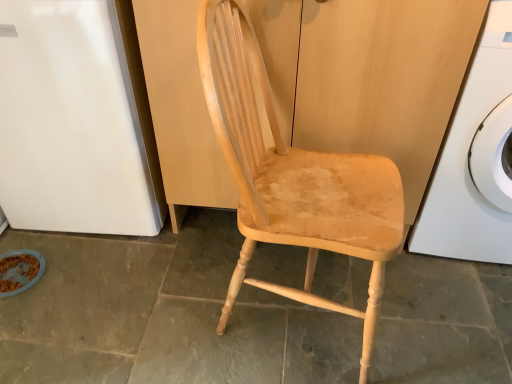
Question: Considering the relative positions of natural wood dresser at center and brown crumbly food at lower left in the image provided, is natural wood dresser at center to the left of brown crumbly food at lower left from the viewer's perspective?

Choices:
 (A) no
 (B) yes

Answer: (A)

Question: From a real-world perspective, is natural wood dresser at center beneath brown crumbly food at lower left?

Choices:
 (A) yes
 (B) no

Answer: (B)

Question: Is brown crumbly food at lower left completely or partially inside natural wood dresser at center?

Choices:
 (A) no
 (B) yes

Answer: (A)

Question: Considering the relative sizes of natural wood dresser at center and brown crumbly food at lower left in the image provided, is natural wood dresser at center bigger than brown crumbly food at lower left?

Choices:
 (A) no
 (B) yes

Answer: (B)

Question: Considering the relative positions of natural wood dresser at center and brown crumbly food at lower left in the image provided, is natural wood dresser at center behind brown crumbly food at lower left?

Choices:
 (A) yes
 (B) no

Answer: (B)

Question: From their relative heights in the image, would you say white glossy refrigerator at left is taller or shorter than natural wood dresser at center?

Choices:
 (A) tall
 (B) short

Answer: (B)

Question: In terms of width, does white glossy refrigerator at left look wider or thinner when compared to natural wood dresser at center?

Choices:
 (A) thin
 (B) wide

Answer: (B)

Question: Choose the correct answer: Is white glossy refrigerator at left inside natural wood dresser at center or outside it?

Choices:
 (A) inside
 (B) outside

Answer: (B)

Question: From the image's perspective, is white glossy refrigerator at left located above or below natural wood dresser at center?

Choices:
 (A) below
 (B) above

Answer: (B)

Question: In terms of width, does natural wood chair at center look wider or thinner when compared to white glossy refrigerator at left?

Choices:
 (A) wide
 (B) thin

Answer: (B)

Question: Is natural wood chair at center to the left or to the right of white glossy refrigerator at left in the image?

Choices:
 (A) right
 (B) left

Answer: (A)

Question: From the image's perspective, is natural wood chair at center located above or below white glossy refrigerator at left?

Choices:
 (A) above
 (B) below

Answer: (B)

Question: Which is correct: natural wood chair at center is inside white glossy refrigerator at left, or outside of it?

Choices:
 (A) inside
 (B) outside

Answer: (B)

Question: Does point (463, 163) appear closer or farther from the camera than point (135, 190)?

Choices:
 (A) closer
 (B) farther

Answer: (A)

Question: Would you say white glossy washing machine at right is to the left or to the right of white glossy refrigerator at left in the picture?

Choices:
 (A) right
 (B) left

Answer: (A)